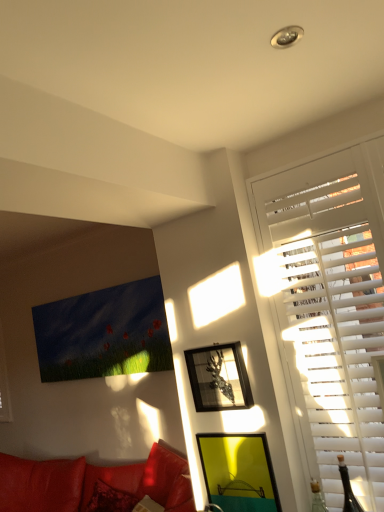
Question: Is leather couch at lower left situated inside metallic silver picture frame at upper right, which is counted as the second picture frame, starting from the bottom, or outside?

Choices:
 (A) inside
 (B) outside

Answer: (B)

Question: From a real-world perspective, is leather couch at lower left positioned above or below metallic silver picture frame at upper right, which is counted as the second picture frame, starting from the bottom?

Choices:
 (A) above
 (B) below

Answer: (B)

Question: Which of these objects is positioned closest to the metallic silver picture frame at upper right, the first picture frame viewed from the top?

Choices:
 (A) yellow matte picture frame at lower center, the second picture frame when ordered from top to bottom
 (B) white wood blinds at right
 (C) leather couch at lower left

Answer: (A)

Question: Considering the real-world distances, which object is closest to the yellow matte picture frame at lower center, the first picture frame from the bottom?

Choices:
 (A) metallic silver picture frame at upper right, the first picture frame viewed from the top
 (B) leather couch at lower left
 (C) white wood blinds at right

Answer: (A)